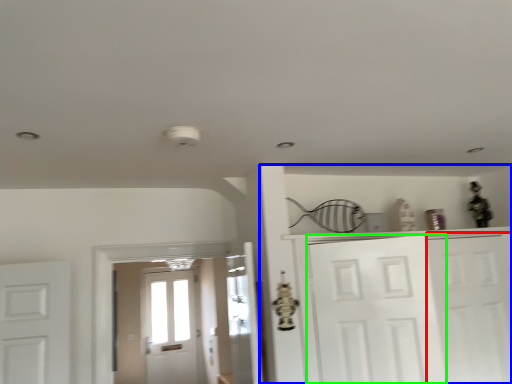
Question: Which object is positioned closest to door (highlighted by a red box)? Select from dresser (highlighted by a blue box) and door (highlighted by a green box).

Choices:
 (A) dresser
 (B) door

Answer: (B)